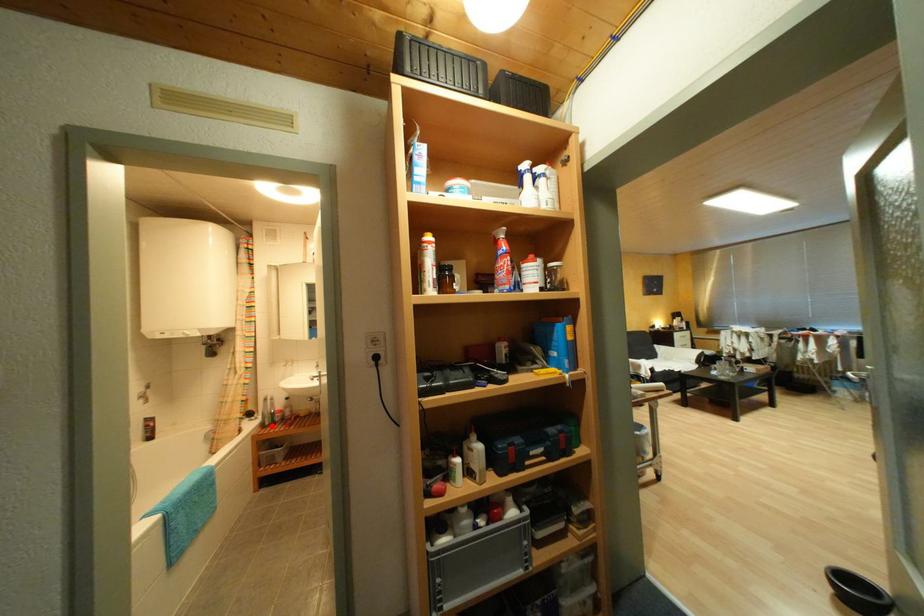
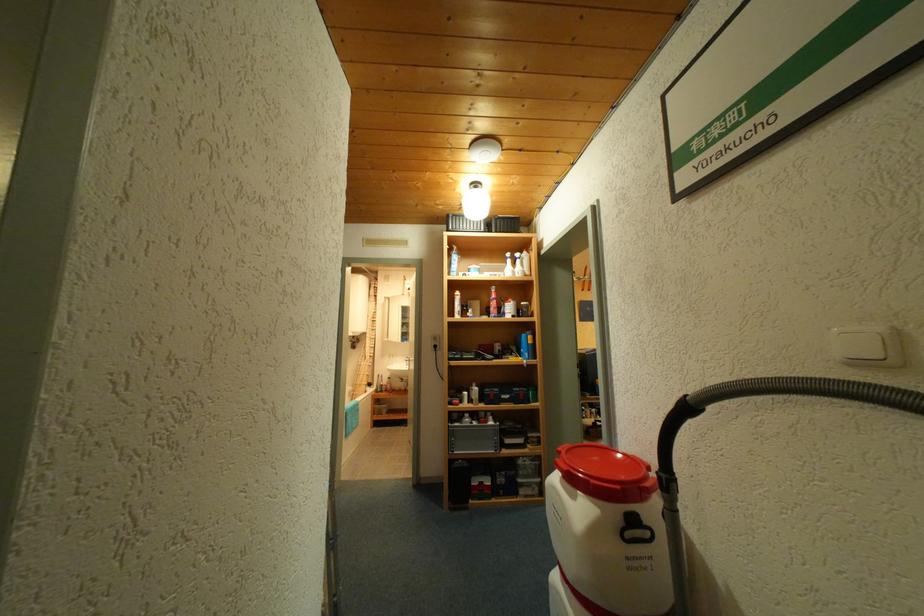
Question: I am providing you with two images of the same scene from different viewpoints. Given a red point in image1, look at the same physical point in image2. Is it:

Choices:
 (A) Closer to the viewpoint
 (B) Farther from the viewpoint

Answer: (B)